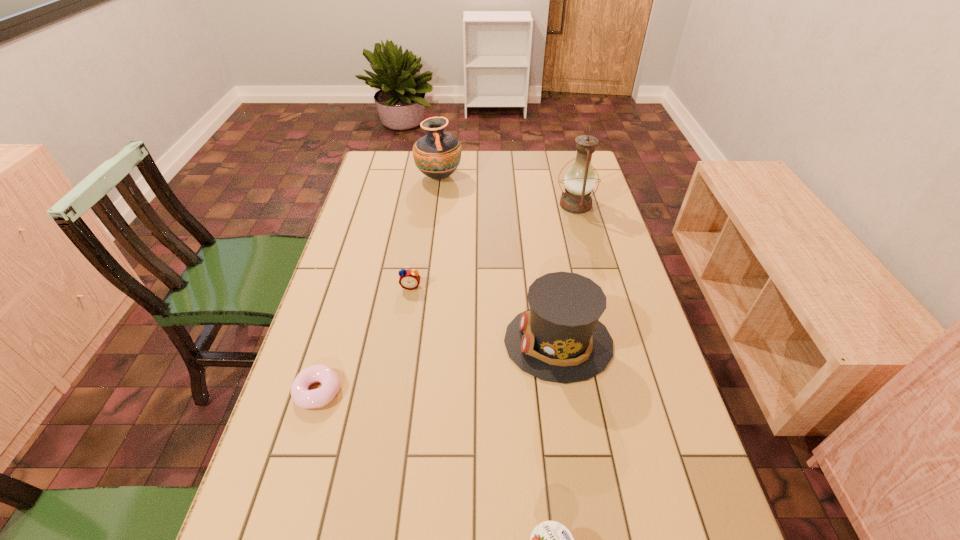
In order to click on vacant area that lies between the dress hat and the alarm clock in this screenshot , I will do `click(485, 314)`.

You are a GUI agent. You are given a task and a screenshot of the screen. Output one action in this format:
    pyautogui.click(x=<x>, y=<y>)
    Task: Click on the vacant area between the fifth nearest object and the pottery
    
    Given the screenshot: What is the action you would take?
    pyautogui.click(x=507, y=191)

Identify which object is the second nearest to the yogurt. Please provide its 2D coordinates. Your answer should be formatted as a tuple, i.e. [(x, y)], where the tuple contains the x and y coordinates of a point satisfying the conditions above.

[(303, 398)]

I want to click on object that can be found as the fifth closest to the fourth shortest object, so click(437, 155).